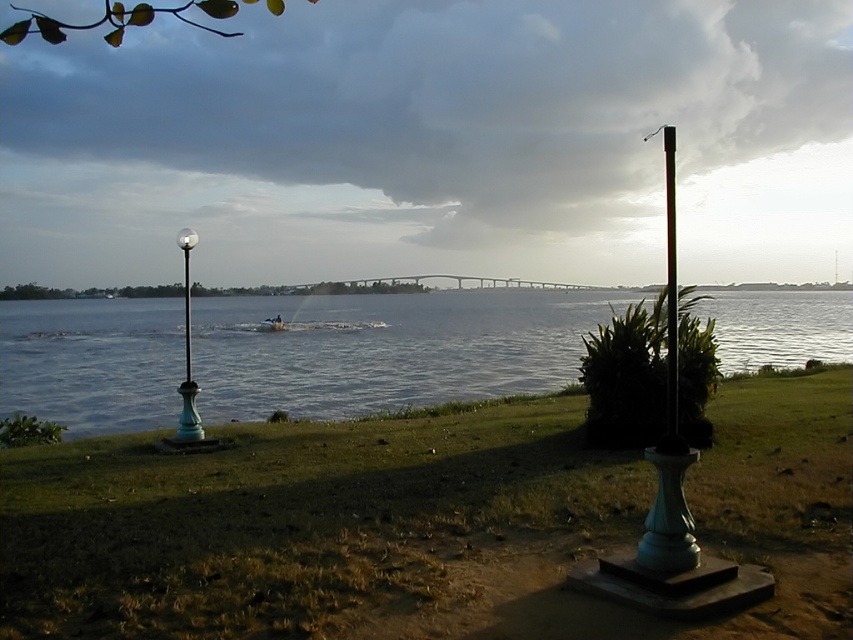
Question: Considering the relative positions of clear water at center and polished dark brown pole at right in the image provided, where is clear water at center located with respect to polished dark brown pole at right?

Choices:
 (A) left
 (B) right

Answer: (A)

Question: Which point is farther to the camera?

Choices:
 (A) clear water at center
 (B) polished dark brown pole at right
 (C) green glass lamp post at left

Answer: (C)

Question: Can you confirm if clear water at center is positioned below polished dark brown pole at right?

Choices:
 (A) yes
 (B) no

Answer: (A)

Question: Among these points, which one is farthest from the camera?

Choices:
 (A) (723, 340)
 (B) (192, 435)
 (C) (670, 234)

Answer: (A)

Question: Considering the real-world distances, which object is farthest from the green glass lamp post at left?

Choices:
 (A) clear water at center
 (B) polished dark brown pole at right

Answer: (B)

Question: Does clear water at center appear on the right side of green glass lamp post at left?

Choices:
 (A) yes
 (B) no

Answer: (A)